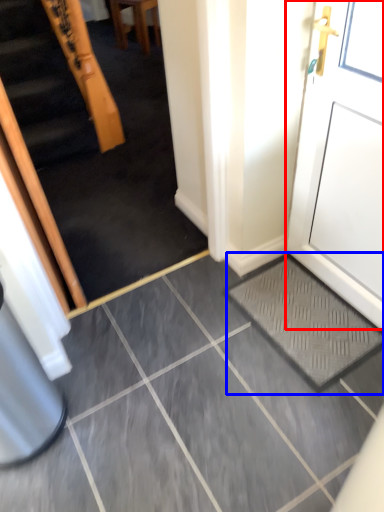
Question: Among these objects, which one is nearest to the camera, door (highlighted by a red box) or doormat (highlighted by a blue box)?

Choices:
 (A) door
 (B) doormat

Answer: (A)